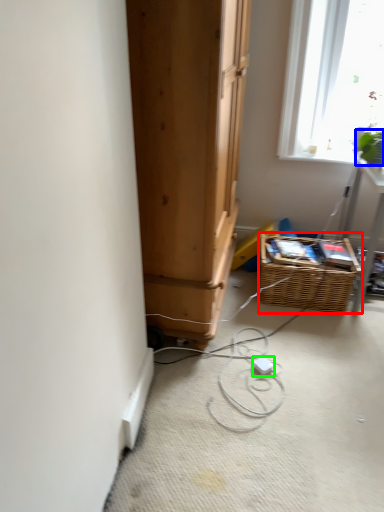
Question: Which is nearer to the basket (highlighted by a red box)? plant (highlighted by a blue box) or extension cord (highlighted by a green box).

Choices:
 (A) plant
 (B) extension cord

Answer: (B)